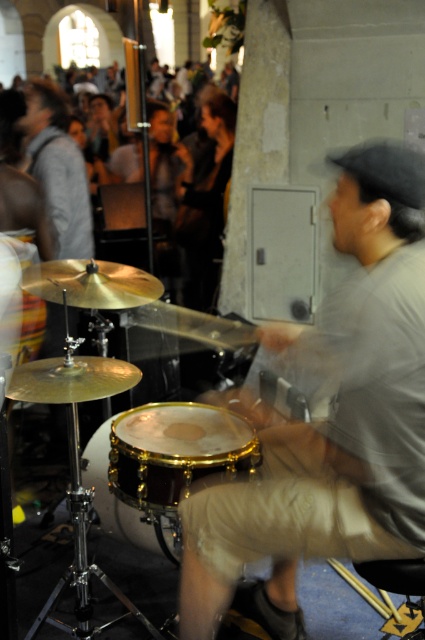
Which is behind, point (59, 228) or point (108, 518)?

Positioned behind is point (59, 228).

Where is `gray matte shirt at upper left`? The width and height of the screenshot is (425, 640). gray matte shirt at upper left is located at coordinates (57, 168).

Who is taller, light gray cotton shirt at center or gold-brushed snare drum at center?

With more height is light gray cotton shirt at center.

In the scene shown: Can you confirm if light gray cotton shirt at center is positioned to the left of gold-brushed snare drum at center?

Incorrect, light gray cotton shirt at center is not on the left side of gold-brushed snare drum at center.

Is point (342, 301) in front of point (161, 516)?

Yes, it is in front of point (161, 516).

This screenshot has width=425, height=640. I want to click on light gray cotton shirt at center, so click(334, 417).

Which is above, shiny gold snare drum at center or gray matte shirt at upper left?

Positioned higher is gray matte shirt at upper left.

Which is behind, point (122, 426) or point (73, 225)?

Positioned behind is point (73, 225).

Locate an element on the screen. shiny gold snare drum at center is located at coordinates (175, 451).